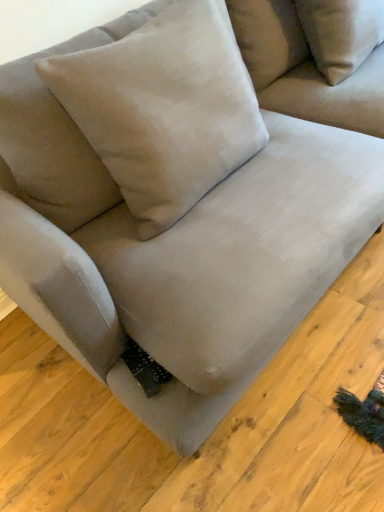
Question: Looking at the image, does velvet beige pillow at center seem bigger or smaller compared to suede-like beige couch at upper right?

Choices:
 (A) small
 (B) big

Answer: (B)

Question: Is velvet beige pillow at center taller or shorter than suede-like beige couch at upper right?

Choices:
 (A) short
 (B) tall

Answer: (B)

Question: Considering the positions of velvet beige pillow at center and suede-like beige couch at upper right in the image, is velvet beige pillow at center wider or thinner than suede-like beige couch at upper right?

Choices:
 (A) wide
 (B) thin

Answer: (B)

Question: In the image, is suede-like beige couch at upper right on the left side or the right side of velvet beige pillow at center?

Choices:
 (A) left
 (B) right

Answer: (B)

Question: Considering the positions of suede-like beige couch at upper right and velvet beige pillow at center in the image, is suede-like beige couch at upper right wider or thinner than velvet beige pillow at center?

Choices:
 (A) thin
 (B) wide

Answer: (B)

Question: Is point [269, 4] closer or farther from the camera than point [124, 192]?

Choices:
 (A) closer
 (B) farther

Answer: (B)

Question: Is suede-like beige couch at upper right in front of or behind velvet beige pillow at center in the image?

Choices:
 (A) front
 (B) behind

Answer: (B)